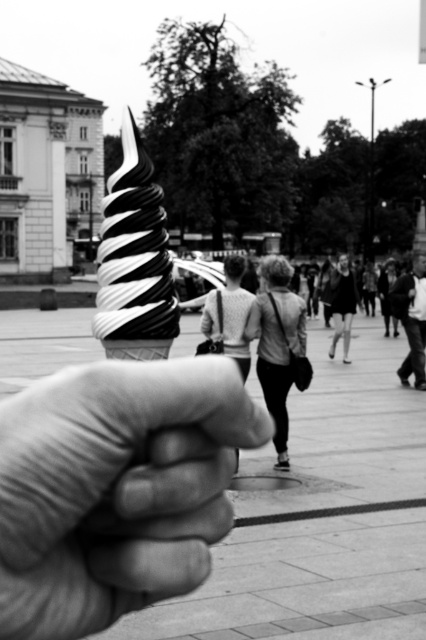
You are an ice cream vendor looking at the photo. You need to place a new ice cream cone to the right of the dark gray fabric jacket at center. Where should you place it relative to the black and white swirl ice cream at center?

The black and white swirl ice cream at center is to the left of the dark gray fabric jacket at center. Therefore, to place the new ice cream cone to the right of the dark gray fabric jacket at center, you should position it to the right of the black and white swirl ice cream at center.

You are standing in the plaza and want to take a photo of the smooth gray jacket at center. Where should you position yourself to capture the jacket in the center of your camera viewfinder?

To capture the smooth gray jacket at center in the center of your camera viewfinder, position yourself directly in front of the jacket at point [276,342].

You are a photographer who wants to adjust the focus of your camera to ensure the black and white swirl ice cream at center is sharp. Given that the current focus point is at coordinates 0.5, 0.5, should you move the focus point closer to the center or away from it to better capture the ice cream?

The black and white swirl ice cream at center is located at point (x=134, y=260). Since the current focus point is at (x=213, y=320), which is slightly to the right and above the ice cream, you should move the focus point closer to the center to align it with the ice cream.